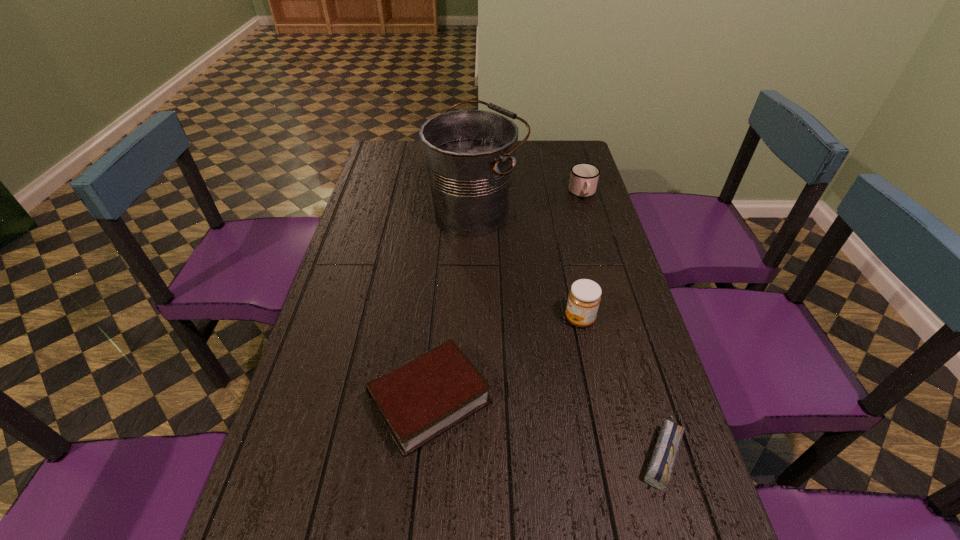
The height and width of the screenshot is (540, 960). In order to click on free space in the image that satisfies the following two spatial constraints: 1. on the front label of the third object from left to right; 2. on the left side of the pencil box in this screenshot , I will do `click(608, 452)`.

Locate an element on the screen. The image size is (960, 540). vacant space that satisfies the following two spatial constraints: 1. on the side of the third tallest object with the handle; 2. on the front label of the third object from right to left is located at coordinates (620, 319).